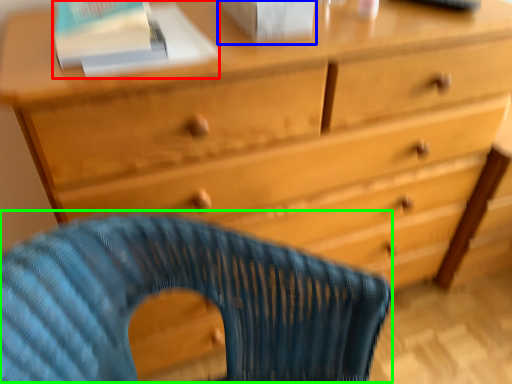
Question: Estimate the real-world distances between objects in this image. Which object is farther from paperback book (highlighted by a red box), paperback book (highlighted by a blue box) or rocking chair (highlighted by a green box)?

Choices:
 (A) paperback book
 (B) rocking chair

Answer: (B)